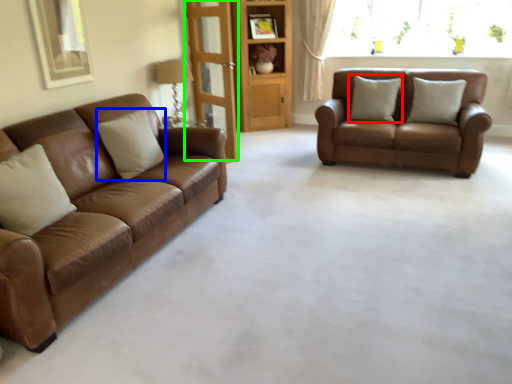
Question: Based on their relative distances, which object is nearer to pillow (highlighted by a red box)? Choose from pillow (highlighted by a blue box) and glass door (highlighted by a green box).

Choices:
 (A) pillow
 (B) glass door

Answer: (B)